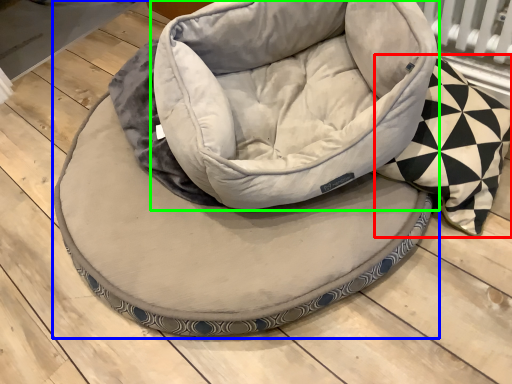
Question: Which is nearer to the throw pillow (highlighted by a red box)? dog bed (highlighted by a blue box) or bean bag chair (highlighted by a green box).

Choices:
 (A) dog bed
 (B) bean bag chair

Answer: (B)